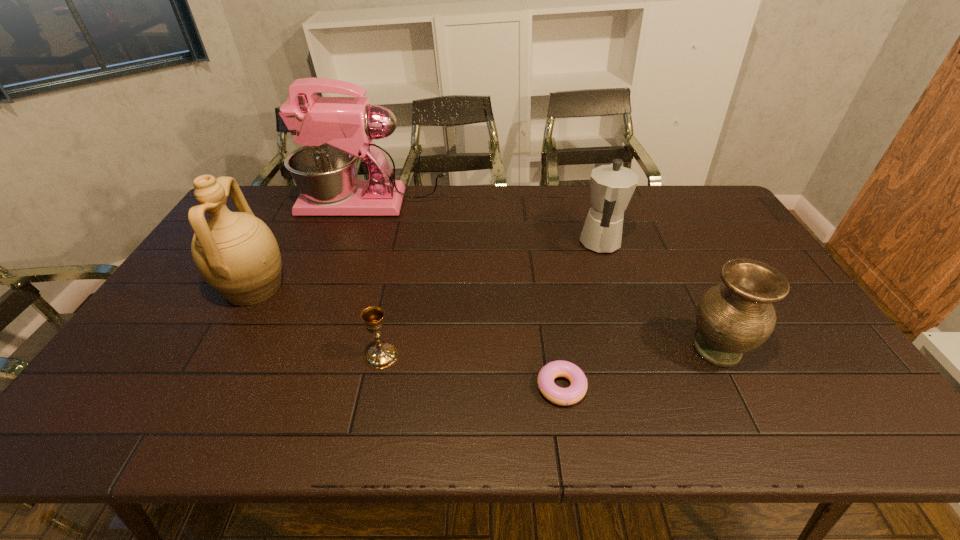
Find the location of a particular element. This screenshot has height=540, width=960. the tallest object is located at coordinates (335, 131).

Locate an element on the screen. This screenshot has height=540, width=960. the farthest object is located at coordinates (335, 131).

Image resolution: width=960 pixels, height=540 pixels. Find the location of `the fifth shortest object`. the fifth shortest object is located at coordinates (236, 253).

Where is `the third tallest object`? The image size is (960, 540). the third tallest object is located at coordinates click(612, 186).

You are a GUI agent. You are given a task and a screenshot of the screen. Output one action in this format:
    pyautogui.click(x=<x>, y=<y>)
    Task: Click on the fifth object from left to right
    
    Given the screenshot: What is the action you would take?
    pyautogui.click(x=612, y=186)

This screenshot has height=540, width=960. I want to click on the fourth tallest object, so click(733, 318).

Where is `vase`? Image resolution: width=960 pixels, height=540 pixels. vase is located at coordinates (733, 318).

Identify the location of chalice. This screenshot has height=540, width=960. (381, 355).

This screenshot has width=960, height=540. What are the coordinates of `the shortest object` in the screenshot? It's located at (576, 391).

This screenshot has height=540, width=960. What are the coordinates of `doughnut` in the screenshot? It's located at (576, 391).